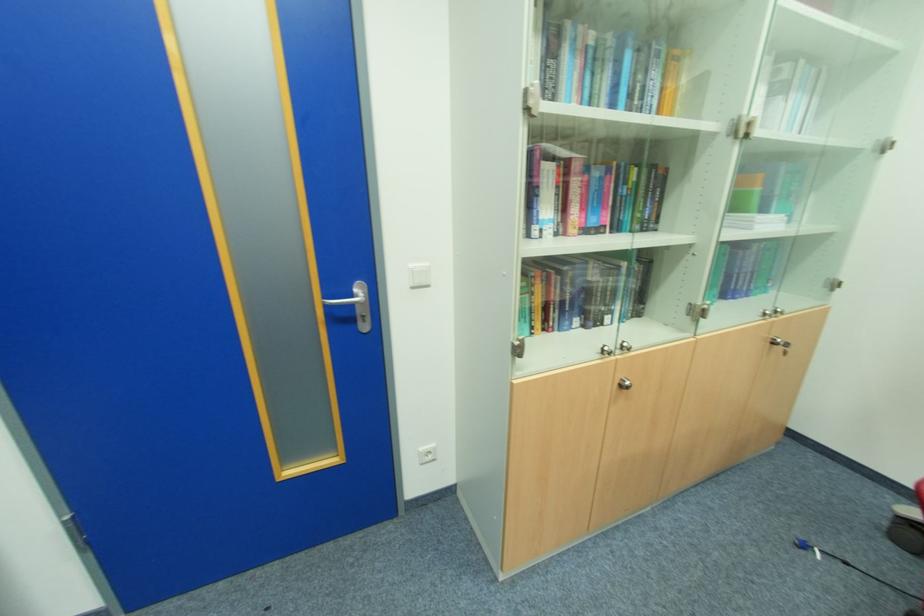
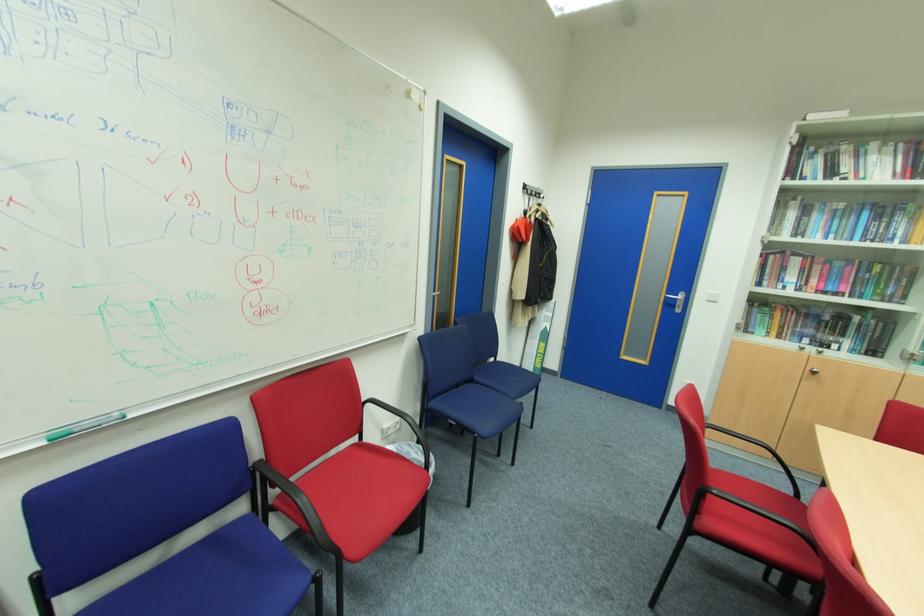
Locate, in the second image, the point that corresponds to the point at 417,288 in the first image.

(711, 301)